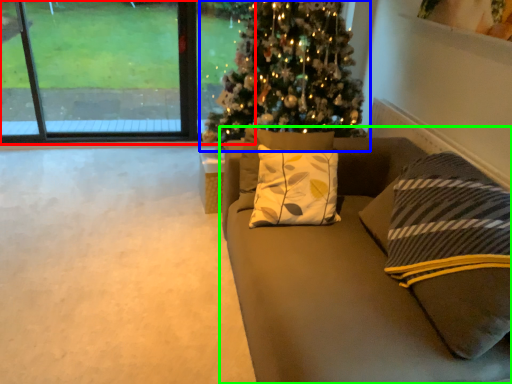
Question: Considering the real-world distances, which object is farthest from window (highlighted by a red box)? christmas tree (highlighted by a blue box) or studio couch (highlighted by a green box)?

Choices:
 (A) christmas tree
 (B) studio couch

Answer: (B)